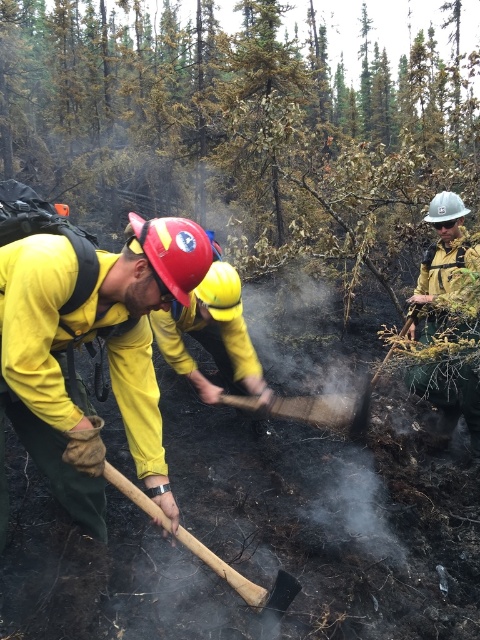
You are a firefighter in the forest and need to quickly grab either the matte yellow jacket at left or the wooden shovel at center. Which item is bigger and easier to reach?

The matte yellow jacket at left is larger in size than the wooden shovel at center, so it is bigger and easier to reach.

You are a firefighter in the forest and need to reach both the point at coordinates (12,268) and the point at (337,416). Which coordinate will you reach first if you move directly towards them?

You will reach the point at coordinates (12,268) first because it is closer to you than the point at (337,416).